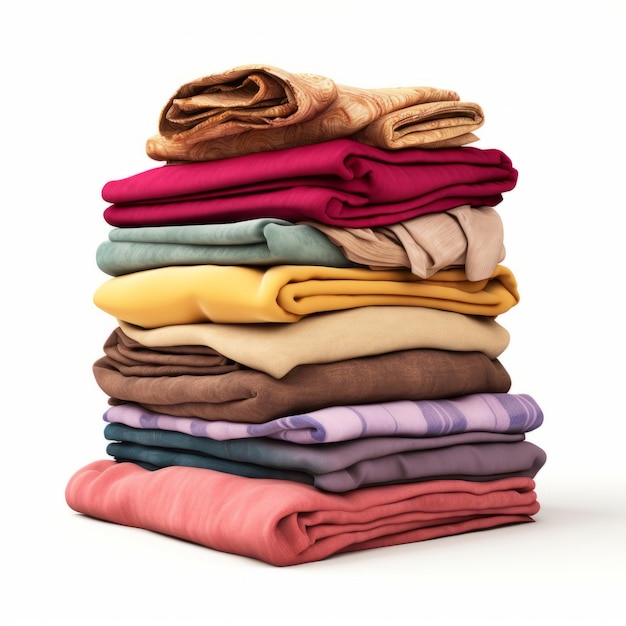
The width and height of the screenshot is (626, 626). Find the location of `stack of clothes`. stack of clothes is located at coordinates (314, 98), (351, 165), (426, 227), (305, 249), (305, 297), (324, 336), (336, 374), (344, 426), (352, 461), (351, 513).